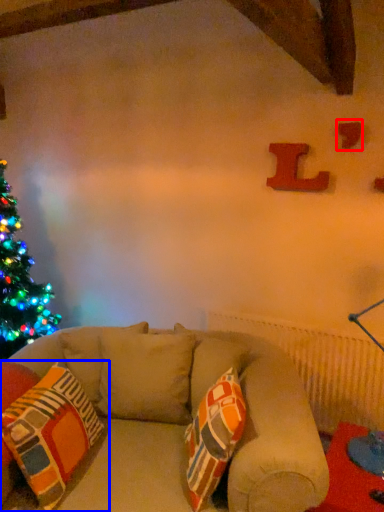
Question: Which object is further to the camera taking this photo, alphabet (highlighted by a red box) or pillow (highlighted by a blue box)?

Choices:
 (A) alphabet
 (B) pillow

Answer: (A)